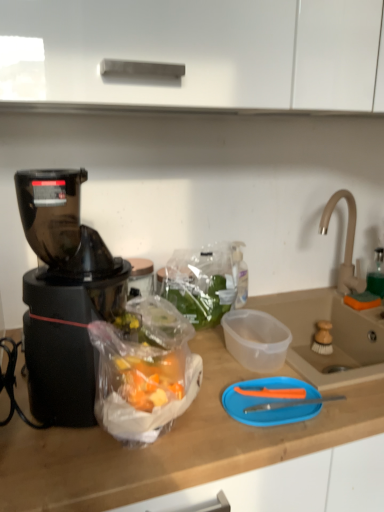
Question: Is black plastic blender at left positioned behind white matte cabinet at upper center?

Choices:
 (A) no
 (B) yes

Answer: (B)

Question: Is black plastic blender at left not near white matte cabinet at upper center?

Choices:
 (A) yes
 (B) no

Answer: (B)

Question: From the image's perspective, is black plastic blender at left located above white matte cabinet at upper center?

Choices:
 (A) yes
 (B) no

Answer: (B)

Question: Is black plastic blender at left smaller than white matte cabinet at upper center?

Choices:
 (A) no
 (B) yes

Answer: (B)

Question: Is black plastic blender at left positioned beyond the bounds of white matte cabinet at upper center?

Choices:
 (A) yes
 (B) no

Answer: (A)

Question: In terms of height, does beige ceramic sink at right, which is counted as the first sink, starting from the top, look taller or shorter compared to white matte cabinet at upper center?

Choices:
 (A) short
 (B) tall

Answer: (B)

Question: In the image, is beige ceramic sink at right, the 2th sink ordered from the bottom, positioned in front of or behind white matte cabinet at upper center?

Choices:
 (A) front
 (B) behind

Answer: (B)

Question: From a real-world perspective, relative to white matte cabinet at upper center, is beige ceramic sink at right, which is counted as the first sink, starting from the top, vertically above or below?

Choices:
 (A) above
 (B) below

Answer: (B)

Question: Is point (354, 364) positioned closer to the camera than point (352, 60)?

Choices:
 (A) farther
 (B) closer

Answer: (A)

Question: Visually, is blue plastic cutting board at center positioned to the left or to the right of black plastic blender at left?

Choices:
 (A) left
 (B) right

Answer: (B)

Question: From a real-world perspective, is blue plastic cutting board at center above or below black plastic blender at left?

Choices:
 (A) below
 (B) above

Answer: (A)

Question: In terms of height, does blue plastic cutting board at center look taller or shorter compared to black plastic blender at left?

Choices:
 (A) short
 (B) tall

Answer: (A)

Question: Is point (266, 400) closer or farther from the camera than point (62, 283)?

Choices:
 (A) closer
 (B) farther

Answer: (B)

Question: From the image's perspective, is transparent plastic sink at right, acting as the 1th sink starting from the bottom, positioned above or below black plastic blender at left?

Choices:
 (A) below
 (B) above

Answer: (A)

Question: Considering the relative positions of transparent plastic sink at right, acting as the 1th sink starting from the bottom, and black plastic blender at left in the image provided, is transparent plastic sink at right, acting as the 1th sink starting from the bottom, to the left or to the right of black plastic blender at left?

Choices:
 (A) left
 (B) right

Answer: (B)